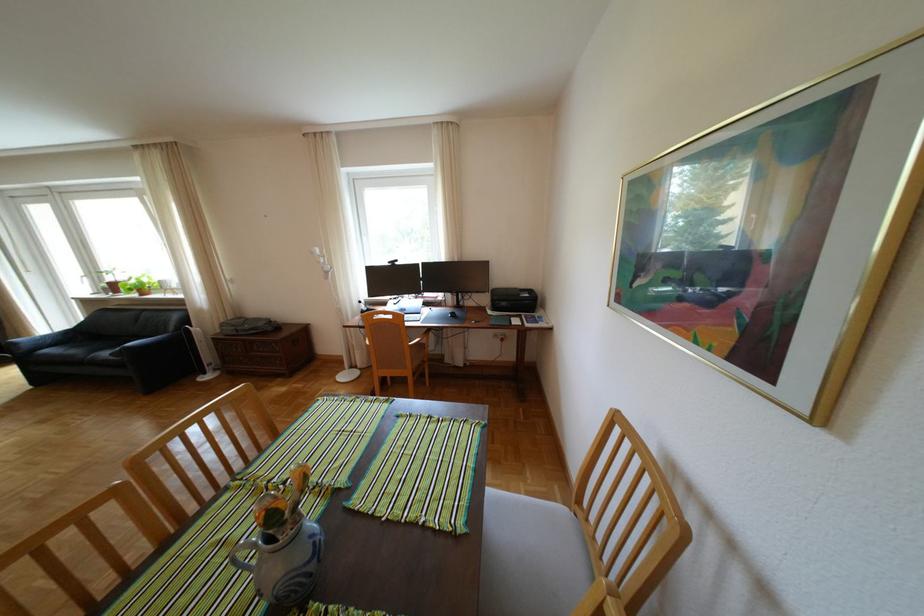
Where would you lean the black sofa armrest? Please return your answer as a coordinate pair (x, y).

(139, 344)